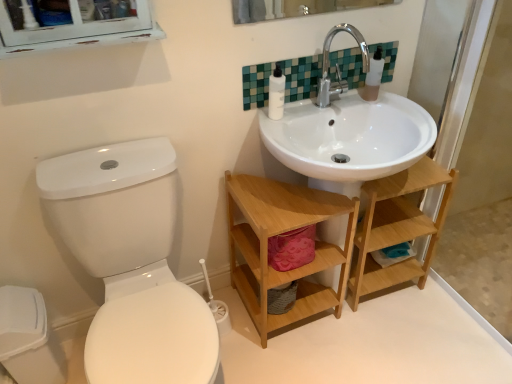
This screenshot has height=384, width=512. I want to click on free space to the left of transparent glass screen door at right, so click(x=408, y=327).